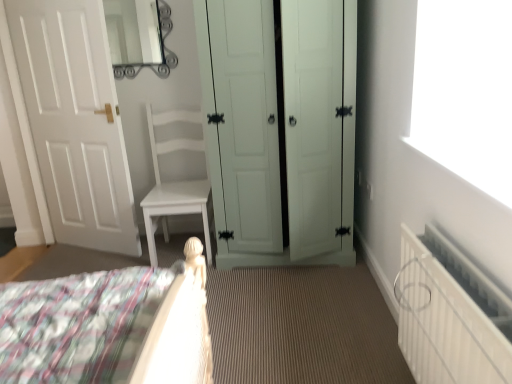
I want to click on white textured radiator at lower right, so click(x=444, y=324).

In the scene shown: What is the approximate height of white matte door at left, acting as the 2th door starting from the right?

It is 1.69 meters.

Where is `white matte door at left, acting as the 2th door starting from the right`? The image size is (512, 384). white matte door at left, acting as the 2th door starting from the right is located at coordinates (75, 121).

Identify the location of metallic silver mirror at upper center. pyautogui.click(x=139, y=36).

Is the depth of light green wood wardrobe at center, which is the 2th door in left-to-right order, greater than that of white matte door at left, which is counted as the 1th door, starting from the left?

No, it is in front of white matte door at left, which is counted as the 1th door, starting from the left.

Considering the relative sizes of light green wood wardrobe at center, the first door in the right-to-left sequence, and white matte door at left, which is counted as the 1th door, starting from the left, in the image provided, is light green wood wardrobe at center, the first door in the right-to-left sequence, wider than white matte door at left, which is counted as the 1th door, starting from the left,?

Yes, light green wood wardrobe at center, the first door in the right-to-left sequence, is wider than white matte door at left, which is counted as the 1th door, starting from the left.

Are light green wood wardrobe at center, the first door in the right-to-left sequence, and white matte door at left, which is counted as the 1th door, starting from the left, making contact?

light green wood wardrobe at center, the first door in the right-to-left sequence, and white matte door at left, which is counted as the 1th door, starting from the left, are not in contact.

From a real-world perspective, is light green wood wardrobe at center, the first door in the right-to-left sequence, located beneath white matte door at left, acting as the 2th door starting from the right?

Yes, from a real-world perspective, light green wood wardrobe at center, the first door in the right-to-left sequence, is below white matte door at left, acting as the 2th door starting from the right.

Is white matte door at left, which is counted as the 1th door, starting from the left, facing away from white textured radiator at lower right?

No, white matte door at left, which is counted as the 1th door, starting from the left,'s orientation is not away from white textured radiator at lower right.

Which is behind, point (102, 167) or point (437, 299)?

Positioned behind is point (102, 167).

From a real-world perspective, who is located higher, white matte door at left, acting as the 2th door starting from the right, or white textured radiator at lower right?

white matte door at left, acting as the 2th door starting from the right, is physically above.

Considering the relative positions of white textured radiator at lower right and white matte door at left, acting as the 2th door starting from the right, in the image provided, is white textured radiator at lower right behind white matte door at left, acting as the 2th door starting from the right,?

No, white textured radiator at lower right is closer to the camera.

Considering the positions of points (415, 354) and (54, 45), is point (415, 354) farther from camera compared to point (54, 45)?

No, it is in front of (54, 45).

In the scene shown: Is white textured radiator at lower right facing away from white matte door at left, which is counted as the 1th door, starting from the left?

No, white textured radiator at lower right's orientation is not away from white matte door at left, which is counted as the 1th door, starting from the left.

Is white textured radiator at lower right inside the boundaries of white matte door at left, acting as the 2th door starting from the right, or outside?

white textured radiator at lower right is spatially situated outside white matte door at left, acting as the 2th door starting from the right.

Based on their sizes in the image, would you say light green wood wardrobe at center, which is the 2th door in left-to-right order, is bigger or smaller than white textured radiator at lower right?

light green wood wardrobe at center, which is the 2th door in left-to-right order, is bigger than white textured radiator at lower right.

In terms of height, does light green wood wardrobe at center, which is the 2th door in left-to-right order, look taller or shorter compared to white textured radiator at lower right?

In the image, light green wood wardrobe at center, which is the 2th door in left-to-right order, appears to be taller than white textured radiator at lower right.

Would you say white textured radiator at lower right is part of light green wood wardrobe at center, which is the 2th door in left-to-right order,'s contents?

No, white textured radiator at lower right is not a part of light green wood wardrobe at center, which is the 2th door in left-to-right order.

Who is smaller, metallic silver mirror at upper center or white textured radiator at lower right?

Smaller between the two is metallic silver mirror at upper center.

Is metallic silver mirror at upper center completely or partially outside of white textured radiator at lower right?

Indeed, metallic silver mirror at upper center is completely outside white textured radiator at lower right.

Considering the sizes of metallic silver mirror at upper center and white textured radiator at lower right in the image, is metallic silver mirror at upper center taller or shorter than white textured radiator at lower right?

In the image, metallic silver mirror at upper center appears to be shorter than white textured radiator at lower right.

Is metallic silver mirror at upper center turned away from white textured radiator at lower right?

metallic silver mirror at upper center is not turned away from white textured radiator at lower right.

From their relative heights in the image, would you say white matte door at left, which is counted as the 1th door, starting from the left, is taller or shorter than light green wood wardrobe at center, the first door in the right-to-left sequence?

Considering their sizes, white matte door at left, which is counted as the 1th door, starting from the left, has more height than light green wood wardrobe at center, the first door in the right-to-left sequence.

From the image's perspective, is white matte door at left, which is counted as the 1th door, starting from the left, located above light green wood wardrobe at center, which is the 2th door in left-to-right order?

Yes, from the image's perspective, white matte door at left, which is counted as the 1th door, starting from the left, is above light green wood wardrobe at center, which is the 2th door in left-to-right order.

Which object is positioned more to the left, white matte door at left, acting as the 2th door starting from the right, or light green wood wardrobe at center, which is the 2th door in left-to-right order?

white matte door at left, acting as the 2th door starting from the right.

How much distance is there between white matte door at left, which is counted as the 1th door, starting from the left, and light green wood wardrobe at center, the first door in the right-to-left sequence?

They are 1.01 meters apart.

Does white textured radiator at lower right have a larger size compared to metallic silver mirror at upper center?

Yes, white textured radiator at lower right is bigger than metallic silver mirror at upper center.

Who is taller, white textured radiator at lower right or metallic silver mirror at upper center?

Standing taller between the two is white textured radiator at lower right.

From the image's perspective, is white textured radiator at lower right under metallic silver mirror at upper center?

Yes, from the image's perspective, white textured radiator at lower right is beneath metallic silver mirror at upper center.

Locate an element on the screen. door that is behind the light green wood wardrobe at center, the first door in the right-to-left sequence is located at coordinates (75, 121).

Identify the location of the 2nd door above when counting from the white textured radiator at lower right (from the image's perspective). The height and width of the screenshot is (384, 512). (75, 121).

Based on their spatial positions, is light green wood wardrobe at center, the first door in the right-to-left sequence, or metallic silver mirror at upper center closer to white matte door at left, acting as the 2th door starting from the right?

Based on the image, metallic silver mirror at upper center appears to be nearer to white matte door at left, acting as the 2th door starting from the right.

Looking at the image, which one is located further to white textured radiator at lower right, light green wood wardrobe at center, which is the 2th door in left-to-right order, or white matte door at left, which is counted as the 1th door, starting from the left?

white matte door at left, which is counted as the 1th door, starting from the left, is further to white textured radiator at lower right.

Based on their spatial positions, is white matte door at left, acting as the 2th door starting from the right, or metallic silver mirror at upper center closer to light green wood wardrobe at center, which is the 2th door in left-to-right order?

white matte door at left, acting as the 2th door starting from the right, is closer to light green wood wardrobe at center, which is the 2th door in left-to-right order.

Looking at the image, which one is located closer to light green wood wardrobe at center, which is the 2th door in left-to-right order, white textured radiator at lower right or white matte door at left, which is counted as the 1th door, starting from the left?

white matte door at left, which is counted as the 1th door, starting from the left, is positioned closer to the anchor light green wood wardrobe at center, which is the 2th door in left-to-right order.

Consider the image. Considering their positions, is metallic silver mirror at upper center positioned further to light green wood wardrobe at center, which is the 2th door in left-to-right order, than white matte door at left, acting as the 2th door starting from the right?

metallic silver mirror at upper center.

From the picture: Which object lies further to the anchor point white matte door at left, which is counted as the 1th door, starting from the left, white textured radiator at lower right or light green wood wardrobe at center, the first door in the right-to-left sequence?

white textured radiator at lower right lies further to white matte door at left, which is counted as the 1th door, starting from the left, than the other object.

Which object lies nearer to the anchor point light green wood wardrobe at center, which is the 2th door in left-to-right order, white matte door at left, acting as the 2th door starting from the right, or white textured radiator at lower right?

white matte door at left, acting as the 2th door starting from the right.

Looking at the image, which one is located further to metallic silver mirror at upper center, white textured radiator at lower right or white matte door at left, which is counted as the 1th door, starting from the left?

white textured radiator at lower right lies further to metallic silver mirror at upper center than the other object.

This screenshot has height=384, width=512. Find the location of `door between white matte door at left, which is counted as the 1th door, starting from the left, and white textured radiator at lower right, in the horizontal direction`. door between white matte door at left, which is counted as the 1th door, starting from the left, and white textured radiator at lower right, in the horizontal direction is located at coordinates (278, 125).

Where is `mirror between white matte door at left, which is counted as the 1th door, starting from the left, and light green wood wardrobe at center, which is the 2th door in left-to-right order, in the horizontal direction`? The height and width of the screenshot is (384, 512). mirror between white matte door at left, which is counted as the 1th door, starting from the left, and light green wood wardrobe at center, which is the 2th door in left-to-right order, in the horizontal direction is located at coordinates (139, 36).